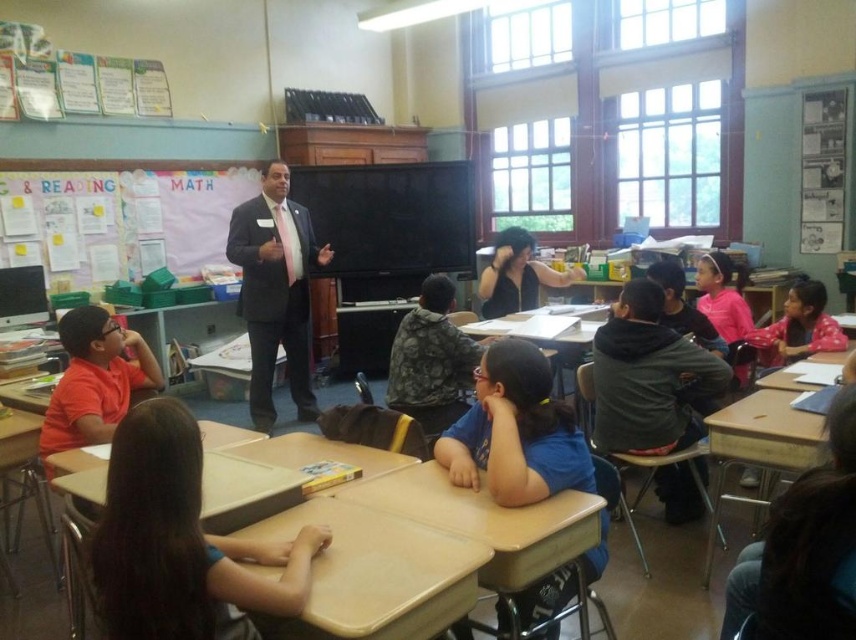
Is light brown wood desk at center below pink cotton shirt at right?

Yes, light brown wood desk at center is below pink cotton shirt at right.

Between light brown wood desk at center and pink cotton shirt at right, which one appears on the right side from the viewer's perspective?

pink cotton shirt at right

You are a GUI agent. You are given a task and a screenshot of the screen. Output one action in this format:
    pyautogui.click(x=<x>, y=<y>)
    Task: Click on the light brown wood desk at center
    This screenshot has width=856, height=640.
    Given the screenshot: What is the action you would take?
    pyautogui.click(x=428, y=502)

Is dark suit at center to the right of light brown wood desk at lower right from the viewer's perspective?

In fact, dark suit at center is to the left of light brown wood desk at lower right.

Who is more forward, [308,216] or [785,435]?

Point [785,435] is in front.

This screenshot has width=856, height=640. What do you see at coordinates (275, 291) in the screenshot?
I see `dark suit at center` at bounding box center [275, 291].

The image size is (856, 640). In order to click on dark suit at center in this screenshot , I will do `click(275, 291)`.

Between light brown wood desk at center and tan matte table at center, which one has more height?

light brown wood desk at center

Which is above, light brown wood desk at center or tan matte table at center?

light brown wood desk at center is higher up.

Locate an element on the screen. The image size is (856, 640). light brown wood desk at center is located at coordinates (428, 502).